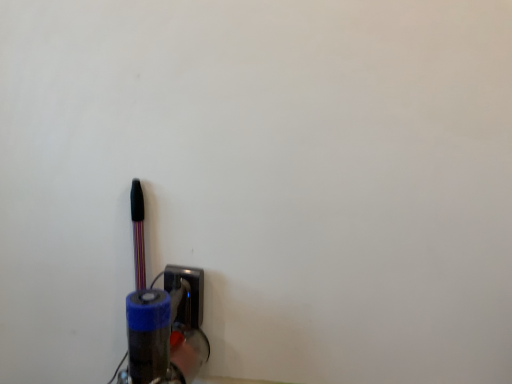
Question: Can we say metallic socket at lower center lies outside metallic pen at left?

Choices:
 (A) yes
 (B) no

Answer: (A)

Question: Is metallic socket at lower center facing away from metallic pen at left?

Choices:
 (A) yes
 (B) no

Answer: (B)

Question: Considering the relative sizes of metallic socket at lower center and metallic pen at left in the image provided, is metallic socket at lower center shorter than metallic pen at left?

Choices:
 (A) no
 (B) yes

Answer: (B)

Question: Does metallic socket at lower center have a larger size compared to metallic pen at left?

Choices:
 (A) no
 (B) yes

Answer: (A)

Question: Can you confirm if metallic socket at lower center is wider than metallic pen at left?

Choices:
 (A) no
 (B) yes

Answer: (A)

Question: Is metallic socket at lower center in contact with metallic pen at left?

Choices:
 (A) yes
 (B) no

Answer: (B)

Question: From a real-world perspective, is metallic pen at left on top of metallic socket at lower center?

Choices:
 (A) yes
 (B) no

Answer: (A)

Question: Can you confirm if metallic pen at left is bigger than metallic socket at lower center?

Choices:
 (A) yes
 (B) no

Answer: (A)

Question: Is metallic pen at left facing towards metallic socket at lower center?

Choices:
 (A) yes
 (B) no

Answer: (B)

Question: Is metallic pen at left placed right next to metallic socket at lower center?

Choices:
 (A) yes
 (B) no

Answer: (B)

Question: Is metallic pen at left at the left side of metallic socket at lower center?

Choices:
 (A) no
 (B) yes

Answer: (B)

Question: Does metallic pen at left have a greater height compared to metallic socket at lower center?

Choices:
 (A) no
 (B) yes

Answer: (B)

Question: From the image's perspective, is metallic socket at lower center positioned above or below metallic pen at left?

Choices:
 (A) below
 (B) above

Answer: (A)